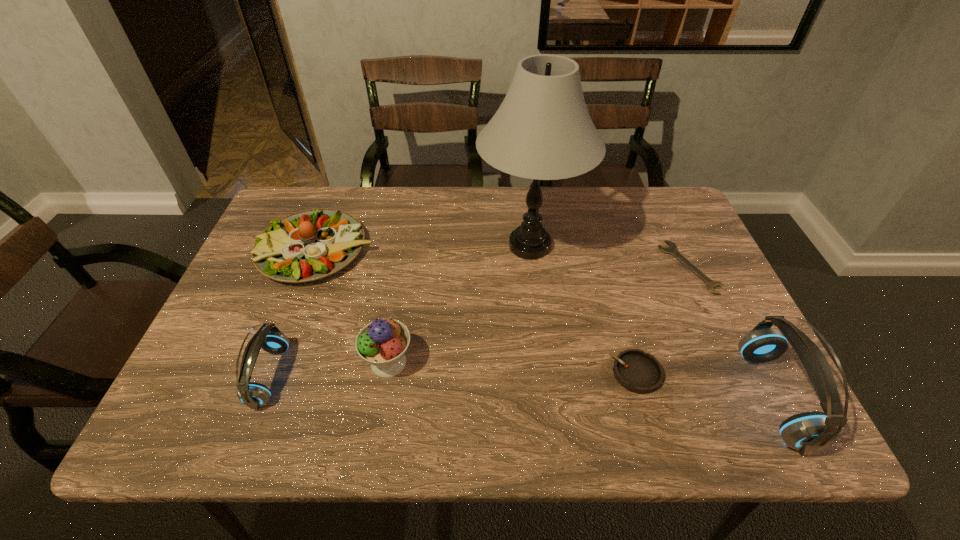
This screenshot has width=960, height=540. Find the location of `headset located at the right edge`. headset located at the right edge is located at coordinates (810, 432).

You are a GUI agent. You are given a task and a screenshot of the screen. Output one action in this format:
    pyautogui.click(x=<x>, y=<y>)
    Task: Click on the wrench that is at the right edge
    
    Given the screenshot: What is the action you would take?
    pyautogui.click(x=672, y=249)

Image resolution: width=960 pixels, height=540 pixels. In order to click on object at the far left corner in this screenshot , I will do `click(312, 244)`.

Locate an element on the screen. object that is positioned at the near left corner is located at coordinates (252, 394).

The image size is (960, 540). I want to click on object located at the near right corner, so click(810, 432).

At what (x,y) coordinates should I click in order to perform the action: click on blank space at the far edge of the desktop. Please return your answer as a coordinate pair (x, y). Looking at the image, I should click on (398, 228).

At what (x,y) coordinates should I click in order to perform the action: click on free region at the near edge of the desktop. Please return your answer as a coordinate pair (x, y). This screenshot has height=540, width=960. Looking at the image, I should click on (554, 367).

At what (x,y) coordinates should I click in order to perform the action: click on vacant region at the left edge of the desktop. Please return your answer as a coordinate pair (x, y). The width and height of the screenshot is (960, 540). Looking at the image, I should click on tap(225, 344).

The width and height of the screenshot is (960, 540). I want to click on vacant space at the right edge, so click(x=658, y=271).

I want to click on free point at the far left corner, so click(322, 189).